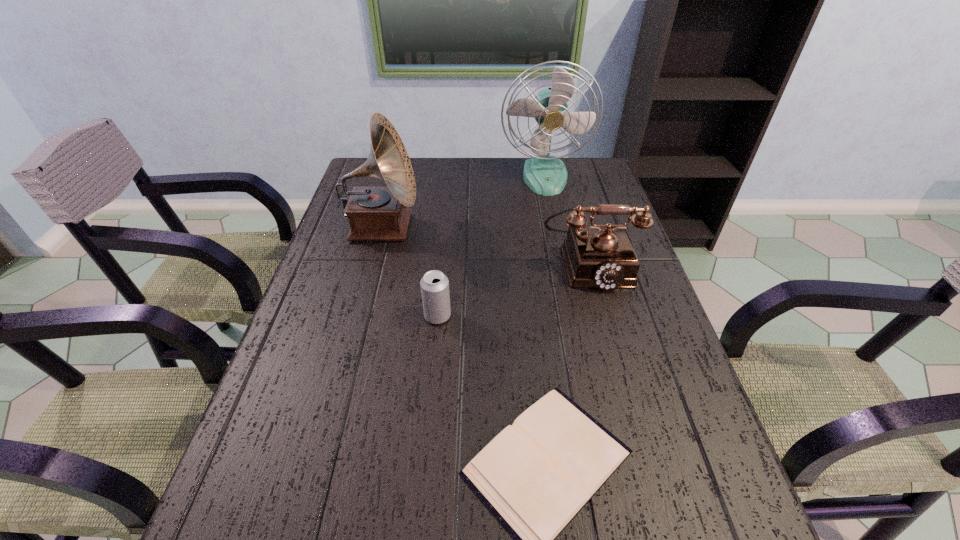
Where is `the farthest object`? Image resolution: width=960 pixels, height=540 pixels. the farthest object is located at coordinates (545, 174).

Identify the location of the leftmost object. The height and width of the screenshot is (540, 960). (374, 213).

The height and width of the screenshot is (540, 960). What are the coordinates of `telephone` in the screenshot? It's located at (600, 256).

This screenshot has height=540, width=960. In order to click on beer can in this screenshot , I will do `click(434, 284)`.

The image size is (960, 540). What are the coordinates of `the fourth tallest object` in the screenshot? It's located at (434, 284).

Find the location of a particular element. The width and height of the screenshot is (960, 540). free space located in front of the farthest object, directing airflow is located at coordinates (564, 267).

Identify the location of vacant space situated on the horn of the phonograph record. (456, 228).

You are a GUI agent. You are given a task and a screenshot of the screen. Output one action in this format:
    pyautogui.click(x=<x>, y=<y>)
    Task: Click on the free space located on the dial of the third tallest object
    This screenshot has width=960, height=540.
    Given the screenshot: What is the action you would take?
    pyautogui.click(x=633, y=417)

In order to click on blank area located on the back of the fourth farthest object in this screenshot , I will do `click(444, 242)`.

The width and height of the screenshot is (960, 540). What are the coordinates of `object present at the far edge` in the screenshot? It's located at (545, 174).